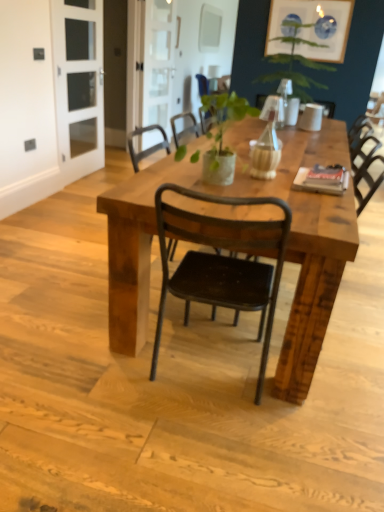
Question: Is green leafy plant at upper center placed right next to black metal chair at center, the 2th chair positioned from the bottom?

Choices:
 (A) yes
 (B) no

Answer: (B)

Question: Is green leafy plant at upper center facing towards black metal chair at center, which is counted as the 2th chair, starting from the front?

Choices:
 (A) no
 (B) yes

Answer: (A)

Question: Is the depth of green leafy plant at upper center greater than that of black metal chair at center, the first chair from the back?

Choices:
 (A) yes
 (B) no

Answer: (B)

Question: Is green leafy plant at upper center positioned before black metal chair at center, the first chair from the back?

Choices:
 (A) no
 (B) yes

Answer: (B)

Question: From a real-world perspective, is green leafy plant at upper center physically above black metal chair at center, the first chair in the top-to-bottom sequence?

Choices:
 (A) no
 (B) yes

Answer: (B)

Question: Is green leafy plant at upper center located outside black metal chair at center, the first chair from the back?

Choices:
 (A) yes
 (B) no

Answer: (A)

Question: Can you confirm if black metal chair at center, the second chair when ordered from back to front, is wider than green leafy plant at upper center?

Choices:
 (A) no
 (B) yes

Answer: (A)

Question: Is black metal chair at center, the second chair when ordered from back to front, located outside green leafy plant at upper center?

Choices:
 (A) yes
 (B) no

Answer: (A)

Question: From a real-world perspective, is black metal chair at center, arranged as the first chair when viewed from the front, physically below green leafy plant at upper center?

Choices:
 (A) no
 (B) yes

Answer: (B)

Question: From the image's perspective, is black metal chair at center, the 2th chair positioned from the top, above green leafy plant at upper center?

Choices:
 (A) no
 (B) yes

Answer: (A)

Question: Is black metal chair at center, the 2th chair positioned from the top, closer to camera compared to green leafy plant at upper center?

Choices:
 (A) no
 (B) yes

Answer: (B)

Question: Does black metal chair at center, arranged as the first chair when viewed from the front, have a smaller size compared to green leafy plant at upper center?

Choices:
 (A) no
 (B) yes

Answer: (B)

Question: Is black metal chair at center, arranged as the first chair when viewed from the front, in front of rustic wood table at center?

Choices:
 (A) yes
 (B) no

Answer: (A)